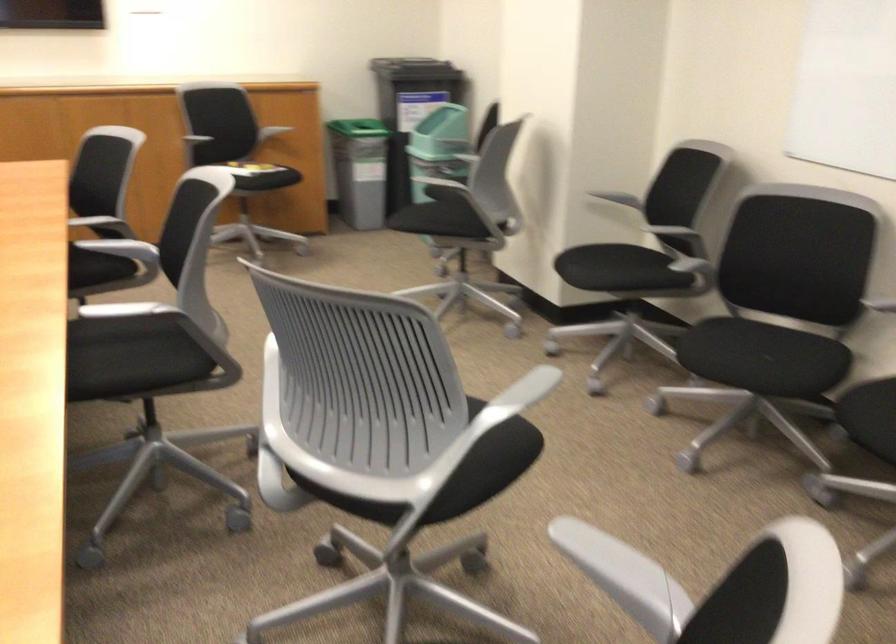
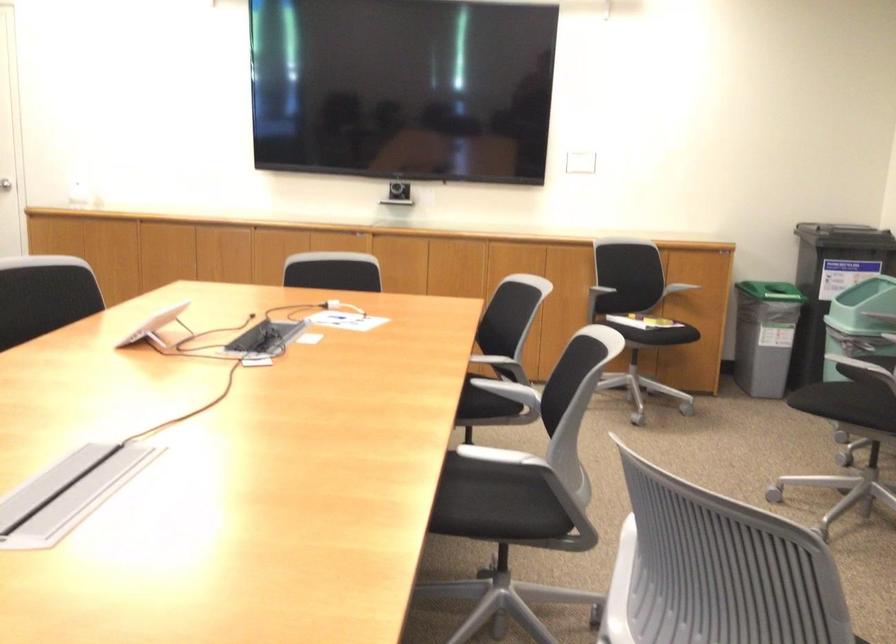
Find the pixel in the second image that matches point 246,162 in the first image.

(636, 313)